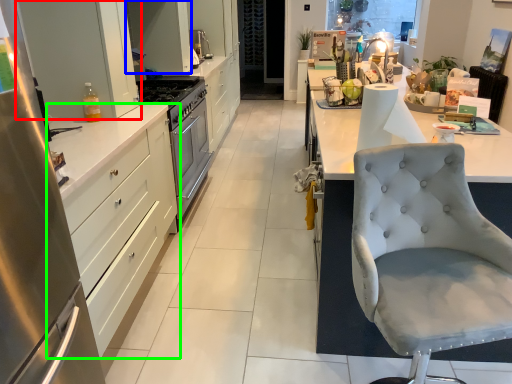
Question: Which is farther away from cabinetry (highlighted by a red box)? cabinetry (highlighted by a blue box) or cabinetry (highlighted by a green box)?

Choices:
 (A) cabinetry
 (B) cabinetry

Answer: (A)